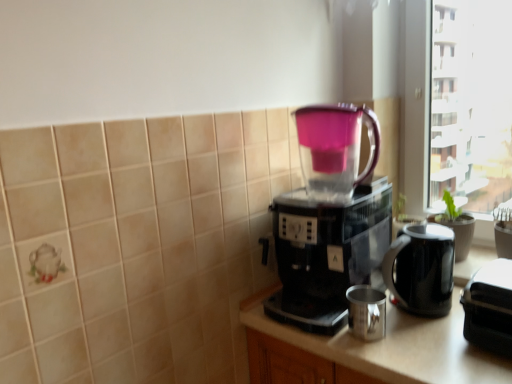
This screenshot has width=512, height=384. I want to click on vacant area that is in front of metallic silver mug at lower center, so [400, 362].